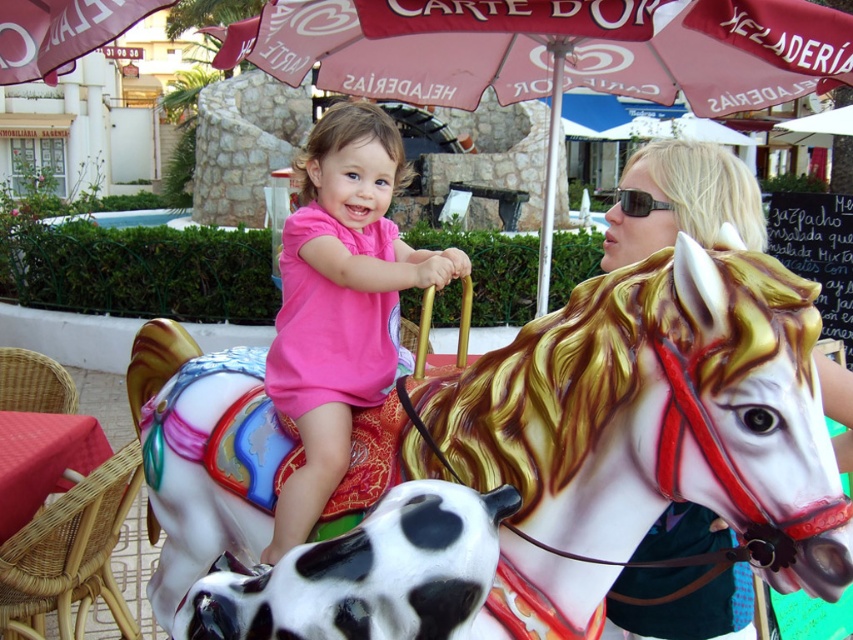
Question: Which object is closer to the camera taking this photo?

Choices:
 (A) matte pink umbrella at upper center
 (B) matte white horse at upper right

Answer: (B)

Question: Does painted wood horse at center appear on the left side of matte pink umbrella at upper center?

Choices:
 (A) no
 (B) yes

Answer: (B)

Question: Which of the following is the farthest from the observer?

Choices:
 (A) matte white horse at upper right
 (B) matte pink umbrella at upper center
 (C) painted wood horse at center

Answer: (B)

Question: Which object is positioned farthest from the pink matte shirt at center?

Choices:
 (A) matte white horse at upper right
 (B) painted wood horse at center
 (C) matte pink umbrella at upper center

Answer: (C)

Question: Does painted wood horse at center appear on the left side of matte white horse at upper right?

Choices:
 (A) yes
 (B) no

Answer: (A)

Question: Is matte pink umbrella at upper center below matte white horse at upper right?

Choices:
 (A) no
 (B) yes

Answer: (A)